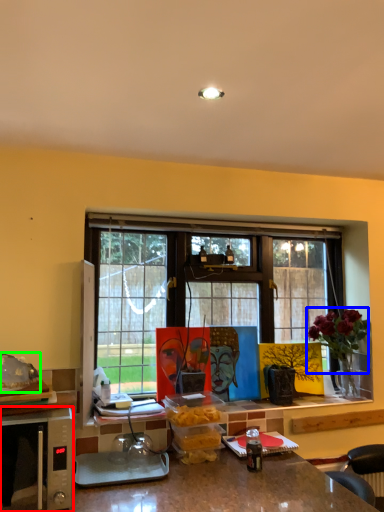
Question: Which is farther away from microwave oven (highlighted by a red box)? flower (highlighted by a blue box) or food (highlighted by a green box)?

Choices:
 (A) flower
 (B) food

Answer: (A)